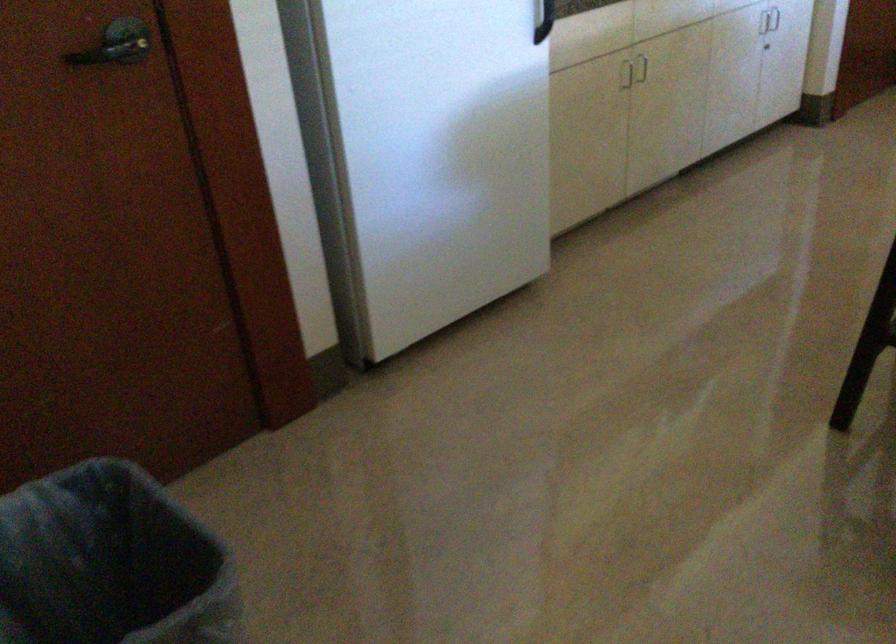
This screenshot has width=896, height=644. Describe the element at coordinates (110, 53) in the screenshot. I see `a black door handle` at that location.